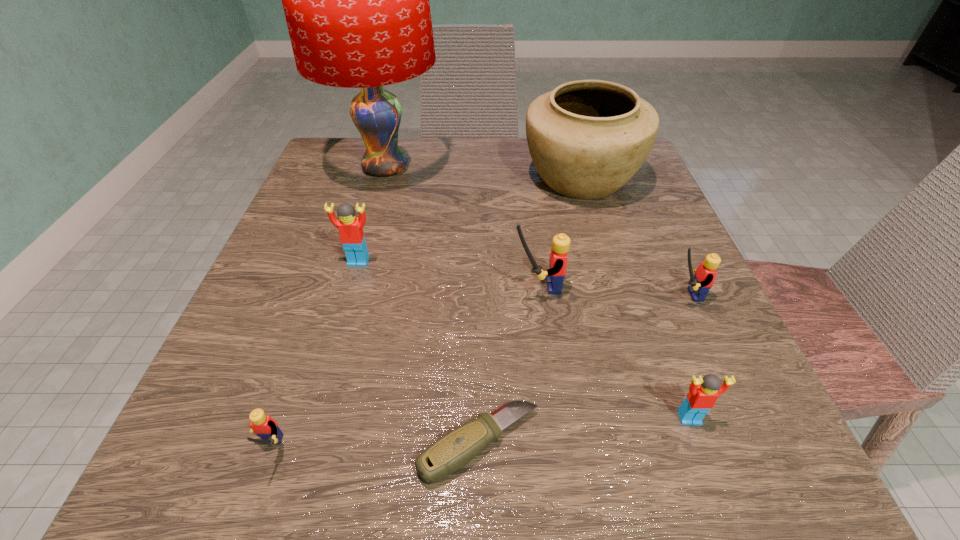
Where is `vacant area that lies between the fourth Lego from left to right and the rightmost Lego`? Image resolution: width=960 pixels, height=540 pixels. vacant area that lies between the fourth Lego from left to right and the rightmost Lego is located at coordinates (685, 356).

Locate an element on the screen. empty location between the farther red Lego and the shortest object is located at coordinates (419, 353).

The height and width of the screenshot is (540, 960). I want to click on empty space between the sixth shortest object and the nearest Lego, so point(402,370).

The width and height of the screenshot is (960, 540). I want to click on vacant region between the sixth shortest object and the smallest yellow Lego, so click(402, 370).

Find the location of a particular element. Image resolution: width=960 pixels, height=540 pixels. unoccupied position between the sixth nearest object and the fourth farthest Lego is located at coordinates click(x=524, y=339).

Where is `vacant area that lies between the third farthest object and the pocketknife`? vacant area that lies between the third farthest object and the pocketknife is located at coordinates (419, 353).

The width and height of the screenshot is (960, 540). Find the location of `empty space that is in between the tallest object and the pottery`. empty space that is in between the tallest object and the pottery is located at coordinates (483, 172).

Locate an element on the screen. The height and width of the screenshot is (540, 960). vacant point located between the smaller red Lego and the rightmost yellow Lego is located at coordinates (685, 356).

Where is `free point between the second smallest yellow Lego and the nearer red Lego`? This screenshot has height=540, width=960. free point between the second smallest yellow Lego and the nearer red Lego is located at coordinates (685, 356).

Locate an element on the screen. vacant point located between the fourth Lego from left to right and the farther red Lego is located at coordinates (524, 339).